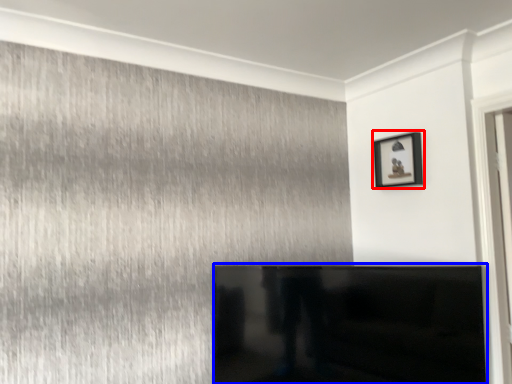
Question: Which object appears closest to the camera in this image, picture frame (highlighted by a red box) or furniture (highlighted by a blue box)?

Choices:
 (A) picture frame
 (B) furniture

Answer: (B)